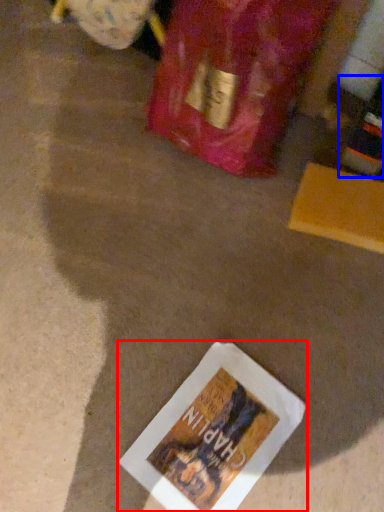
Question: Which object appears farthest to the camera in this image, book (highlighted by a red box) or wine bottle (highlighted by a blue box)?

Choices:
 (A) book
 (B) wine bottle

Answer: (A)